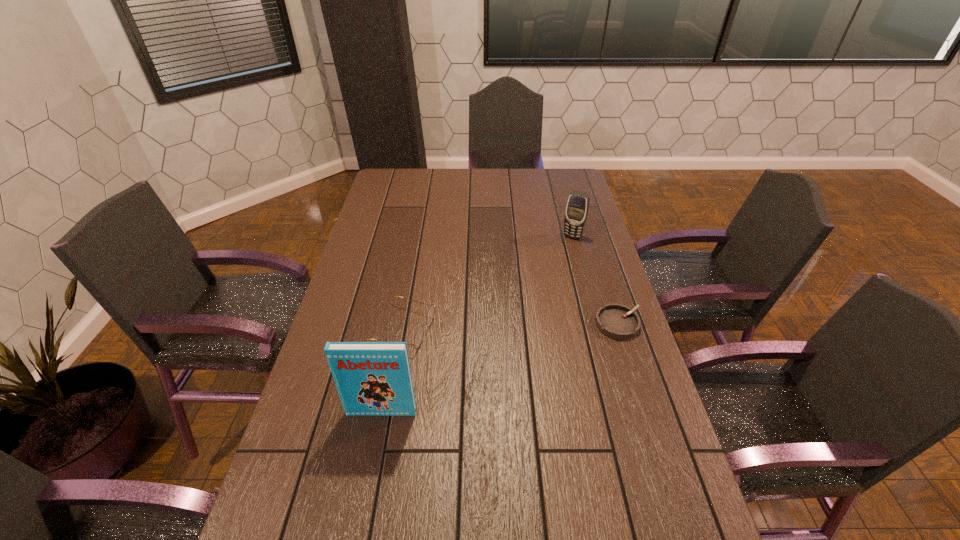
Find the location of a particular element. Image resolution: width=960 pixels, height=540 pixels. free space at the right edge is located at coordinates (635, 362).

The height and width of the screenshot is (540, 960). What are the coordinates of `empty location between the ashtray and the cellular telephone` in the screenshot? It's located at (595, 280).

Identify the location of free spot between the second tallest object and the shortest object. (595, 280).

What are the coordinates of `free spot between the shortest object and the third shortest object` in the screenshot? It's located at (595, 280).

Where is `blank region between the shortest object and the nearest object`? blank region between the shortest object and the nearest object is located at coordinates (x=500, y=368).

You are a GUI agent. You are given a task and a screenshot of the screen. Output one action in this format:
    pyautogui.click(x=<x>, y=<y>)
    Task: Click on the vacant area that lies between the spectacles and the ashtray
    The height and width of the screenshot is (540, 960).
    Given the screenshot: What is the action you would take?
    pyautogui.click(x=510, y=325)

Identify the location of free space between the shortest object and the cellular telephone. (595, 280).

Image resolution: width=960 pixels, height=540 pixels. Find the location of `blank region between the farthest object and the spectacles`. blank region between the farthest object and the spectacles is located at coordinates (487, 282).

Where is `free space between the third shortest object and the shortest object`? free space between the third shortest object and the shortest object is located at coordinates (595, 280).

Point out which object is positioned as the third nearest to the spectacles. Please provide its 2D coordinates. Your answer should be formatted as a tuple, i.e. [(x, y)], where the tuple contains the x and y coordinates of a point satisfying the conditions above.

[(577, 207)]